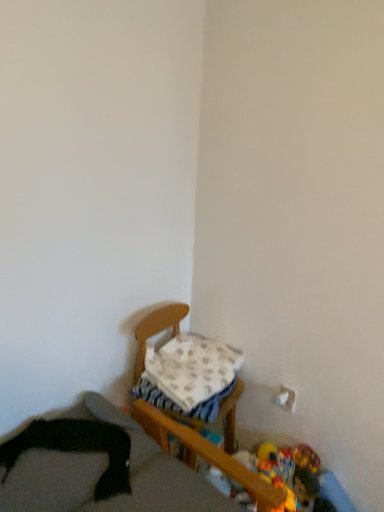
Question: Is plush yellow duck at lower right, which ranks as the first toy in left-to-right order, wider or thinner than plush multicolored toy at lower right, positioned as the 2th toy in right-to-left order?

Choices:
 (A) wide
 (B) thin

Answer: (A)

Question: In terms of height, does plush yellow duck at lower right, the 3th toy in the right-to-left sequence, look taller or shorter compared to plush multicolored toy at lower right, positioned as the 2th toy in right-to-left order?

Choices:
 (A) tall
 (B) short

Answer: (B)

Question: Estimate the real-world distances between objects in this image. Which object is farther from the plush yellow duck at lower right, which is counted as the first toy, starting from the right?

Choices:
 (A) plush yellow duck at lower right, which ranks as the first toy in left-to-right order
 (B) plush multicolored toy at lower right, positioned as the 2th toy in right-to-left order
 (C) white soft blanket at center
 (D) black fabric at lower left, acting as the 2th furniture starting from the back
 (E) wooden chair at center, the second furniture viewed from the front

Answer: (D)

Question: Considering the real-world distances, which object is closest to the wooden chair at center, the second furniture viewed from the front?

Choices:
 (A) black fabric at lower left, positioned as the first furniture in front-to-back order
 (B) plush multicolored toy at lower right, positioned as the 2th toy in right-to-left order
 (C) plush yellow duck at lower right, the third toy when ordered from left to right
 (D) plush yellow duck at lower right, the 3th toy in the right-to-left sequence
 (E) white soft blanket at center

Answer: (E)